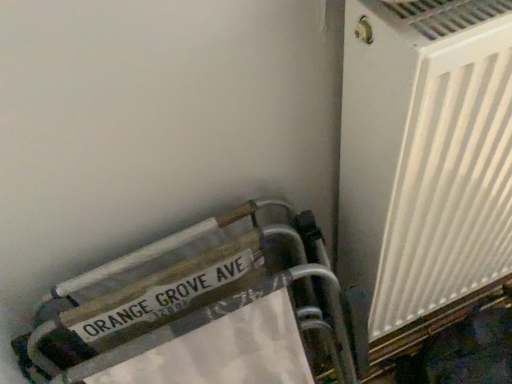
Locate an element on the screen. The height and width of the screenshot is (384, 512). wooden sign at lower left is located at coordinates (197, 316).

What do you see at coordinates (197, 316) in the screenshot? This screenshot has width=512, height=384. I see `wooden sign at lower left` at bounding box center [197, 316].

This screenshot has height=384, width=512. Describe the element at coordinates (424, 155) in the screenshot. I see `white plastic radiator at right` at that location.

Locate an element on the screen. white plastic radiator at right is located at coordinates (424, 155).

What is the approximate height of white plastic radiator at right?

white plastic radiator at right is 38.47 inches in height.

Identify the location of wooden sign at lower left. The width and height of the screenshot is (512, 384). (197, 316).

Is wooden sign at lower left at the left side of white plastic radiator at right?

Yes, wooden sign at lower left is to the left of white plastic radiator at right.

Which object is further away from the camera, wooden sign at lower left or white plastic radiator at right?

Positioned behind is wooden sign at lower left.

Which point is more forward, [46,335] or [377,247]?

Point [46,335]

From the image's perspective, is wooden sign at lower left located above or below white plastic radiator at right?

wooden sign at lower left is below white plastic radiator at right.

From a real-world perspective, who is located higher, wooden sign at lower left or white plastic radiator at right?

white plastic radiator at right.

Considering the relative sizes of wooden sign at lower left and white plastic radiator at right in the image provided, is wooden sign at lower left wider than white plastic radiator at right?

Incorrect, the width of wooden sign at lower left does not surpass that of white plastic radiator at right.

Is wooden sign at lower left shorter than white plastic radiator at right?

Answer: Correct, wooden sign at lower left is not as tall as white plastic radiator at right.

Can you confirm if wooden sign at lower left is bigger than white plastic radiator at right?

Actually, wooden sign at lower left might be smaller than white plastic radiator at right.

Choose the correct answer: Is wooden sign at lower left inside white plastic radiator at right or outside it?

wooden sign at lower left is located beyond the bounds of white plastic radiator at right.

Are wooden sign at lower left and white plastic radiator at right located far from each other?

Actually, wooden sign at lower left and white plastic radiator at right are a little close together.

Is wooden sign at lower left facing away from white plastic radiator at right?

No, white plastic radiator at right is not at the back of wooden sign at lower left.

What's the angular difference between wooden sign at lower left and white plastic radiator at right's facing directions?

The facing directions of wooden sign at lower left and white plastic radiator at right are 0.00156 degrees apart.

At what (x,y) coordinates should I click in order to perform the action: click on air conditioning above the wooden sign at lower left (from a real-world perspective). Please return your answer as a coordinate pair (x, y). This screenshot has width=512, height=384. Looking at the image, I should click on (424, 155).

Which object is positioned more to the right, white plastic radiator at right or wooden sign at lower left?

white plastic radiator at right is more to the right.

Who is more distant, white plastic radiator at right or wooden sign at lower left?

Positioned behind is wooden sign at lower left.

Considering the points (466, 168) and (246, 340), which point is behind, point (466, 168) or point (246, 340)?

The point (246, 340) is farther from the camera.

Based on the photo, from the image's perspective, relative to wooden sign at lower left, is white plastic radiator at right above or below?

From the image's perspective, white plastic radiator at right appears above wooden sign at lower left.

From a real-world perspective, which is physically below, white plastic radiator at right or wooden sign at lower left?

In real-world perspective, wooden sign at lower left is lower.

Is white plastic radiator at right thinner than wooden sign at lower left?

No, white plastic radiator at right is not thinner than wooden sign at lower left.

Can you confirm if white plastic radiator at right is taller than wooden sign at lower left?

Indeed, white plastic radiator at right has a greater height compared to wooden sign at lower left.

Considering the relative sizes of white plastic radiator at right and wooden sign at lower left in the image provided, is white plastic radiator at right smaller than wooden sign at lower left?

Actually, white plastic radiator at right might be larger than wooden sign at lower left.

Would you say wooden sign at lower left is part of white plastic radiator at right's contents?

No, wooden sign at lower left is not inside white plastic radiator at right.

Are white plastic radiator at right and wooden sign at lower left beside each other?

No, white plastic radiator at right is not touching wooden sign at lower left.

Is white plastic radiator at right facing towards wooden sign at lower left?

No, white plastic radiator at right is not turned towards wooden sign at lower left.

How many degrees apart are the facing directions of white plastic radiator at right and wooden sign at lower left?

The angle between the facing direction of white plastic radiator at right and the facing direction of wooden sign at lower left is 0.00156 degrees.

Where is `furniture on the left of white plastic radiator at right`? The image size is (512, 384). furniture on the left of white plastic radiator at right is located at coordinates (197, 316).

You are a GUI agent. You are given a task and a screenshot of the screen. Output one action in this format:
    pyautogui.click(x=<x>, y=<y>)
    Task: Click on the furniture below the white plastic radiator at right (from the image's perspective)
    This screenshot has width=512, height=384.
    Given the screenshot: What is the action you would take?
    pyautogui.click(x=197, y=316)

This screenshot has height=384, width=512. What are the coordinates of `furniture behind the white plastic radiator at right` in the screenshot? It's located at (197, 316).